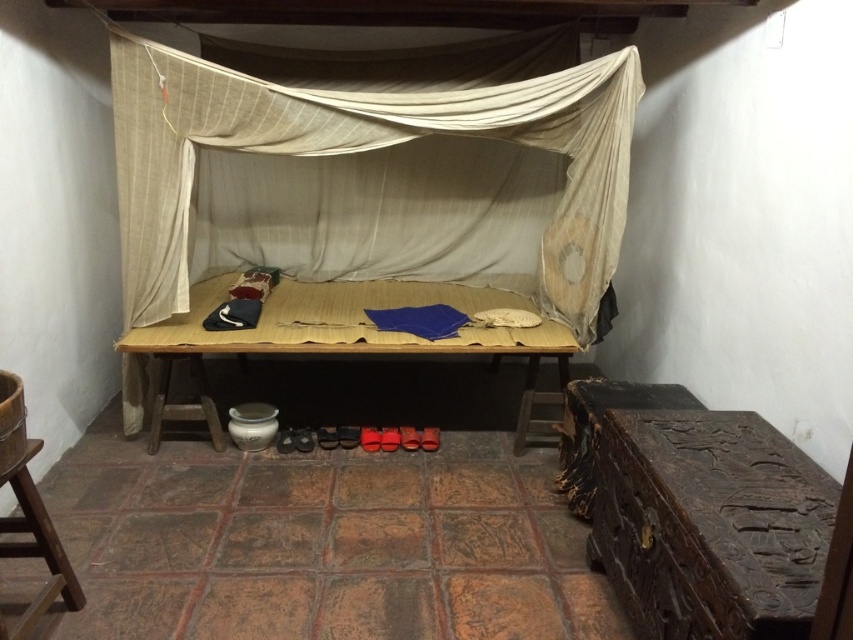
You are standing in the middle of the room and want to place a small lamp on the wooden table at center. However, there is a beige fabric canopy bed at center blocking your path. Can you walk around the bed to reach the table?

The beige fabric canopy bed at center is closer to the viewer than the wooden table at center, so you can walk around the bed to reach the wooden table at center since it is behind the bed.